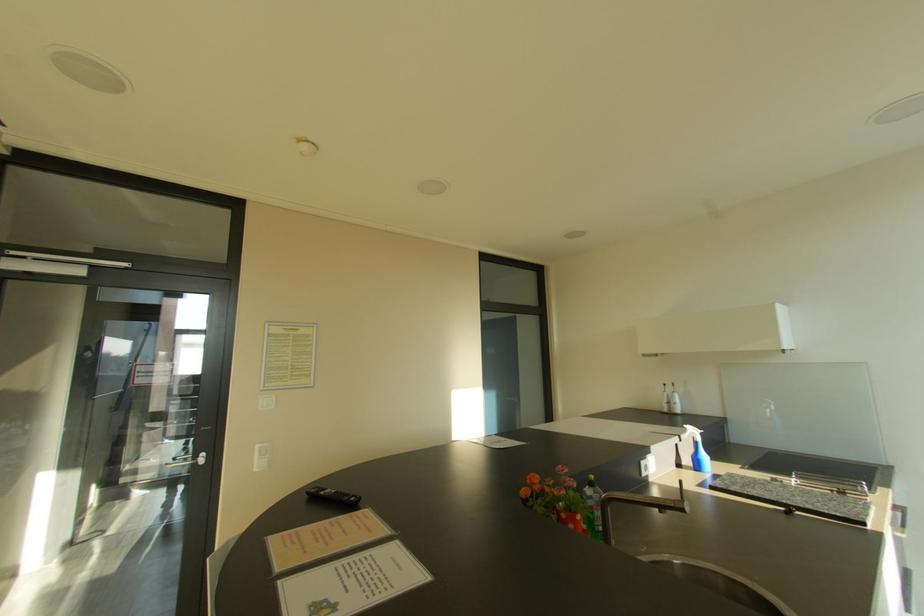
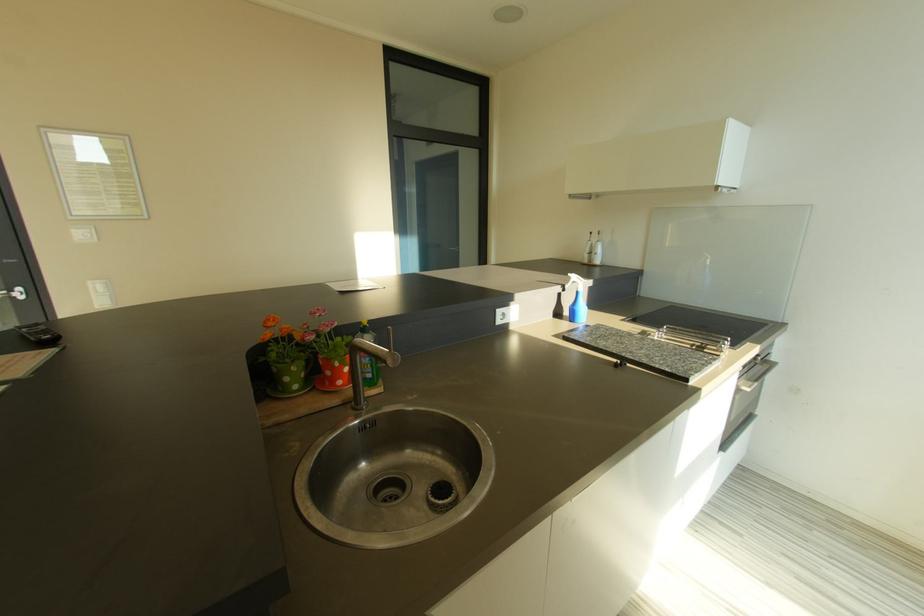
What movement of the cameraman would produce the second image?

The movement direction of the cameraman is right, forward.